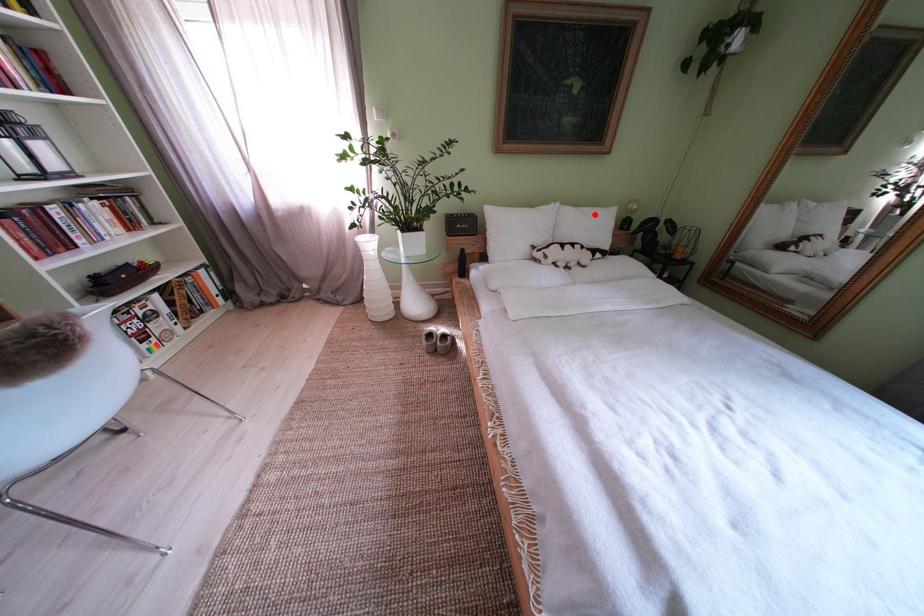
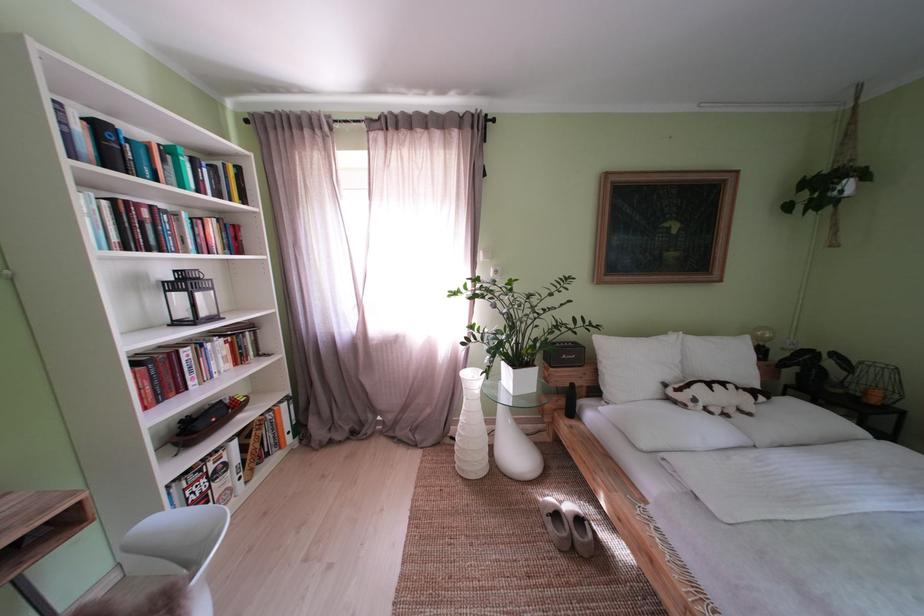
In the second image, find the point that corresponds to the highlighted location in the first image.

(723, 344)